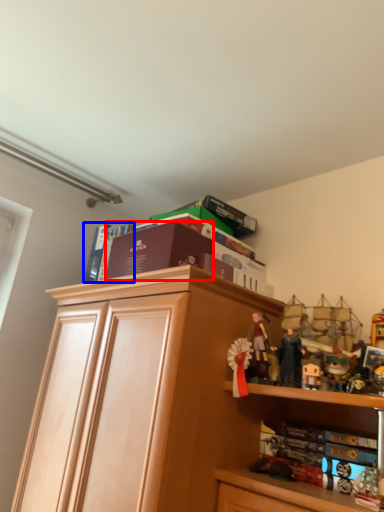
Question: Among these objects, which one is nearest to the camera, book (highlighted by a red box) or book (highlighted by a blue box)?

Choices:
 (A) book
 (B) book

Answer: (A)